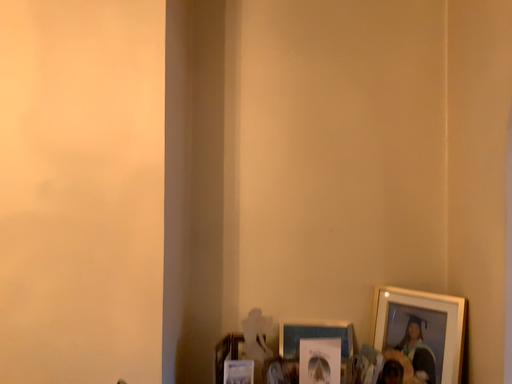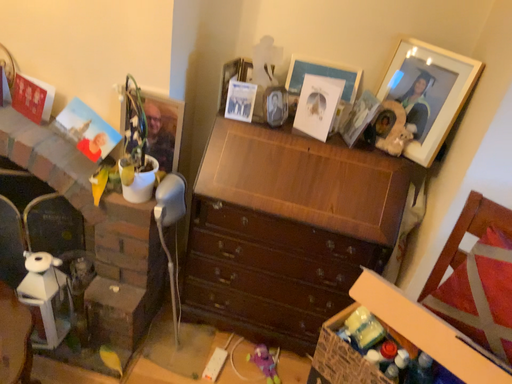
Question: Which way did the camera rotate in the video?

Choices:
 (A) rotated downward
 (B) rotated upward

Answer: (A)